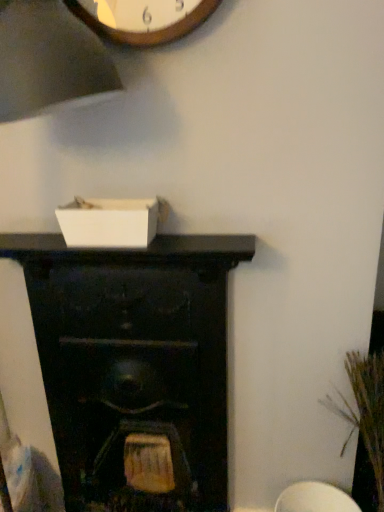
Question: Can you confirm if black wood fireplace at center is positioned to the left of brown textured plant at right?

Choices:
 (A) yes
 (B) no

Answer: (A)

Question: From the image's perspective, does black wood fireplace at center appear lower than brown textured plant at right?

Choices:
 (A) yes
 (B) no

Answer: (B)

Question: Is black wood fireplace at center looking in the opposite direction of brown textured plant at right?

Choices:
 (A) no
 (B) yes

Answer: (A)

Question: Is black wood fireplace at center positioned far away from brown textured plant at right?

Choices:
 (A) yes
 (B) no

Answer: (B)

Question: Is black wood fireplace at center shorter than brown textured plant at right?

Choices:
 (A) no
 (B) yes

Answer: (A)

Question: From a real-world perspective, is black wood fireplace at center under brown textured plant at right?

Choices:
 (A) yes
 (B) no

Answer: (B)

Question: From a real-world perspective, is brown textured plant at right below black wood fireplace at center?

Choices:
 (A) yes
 (B) no

Answer: (A)

Question: Is brown textured plant at right at the left side of black wood fireplace at center?

Choices:
 (A) no
 (B) yes

Answer: (A)

Question: From the image's perspective, is brown textured plant at right under black wood fireplace at center?

Choices:
 (A) no
 (B) yes

Answer: (B)

Question: Is brown textured plant at right positioned with its back to black wood fireplace at center?

Choices:
 (A) yes
 (B) no

Answer: (B)

Question: Can you confirm if brown textured plant at right is taller than black wood fireplace at center?

Choices:
 (A) no
 (B) yes

Answer: (A)

Question: Would you say brown textured plant at right is outside black wood fireplace at center?

Choices:
 (A) no
 (B) yes

Answer: (B)

Question: Would you say black wood fireplace at center is to the left or to the right of brown textured plant at right in the picture?

Choices:
 (A) right
 (B) left

Answer: (B)